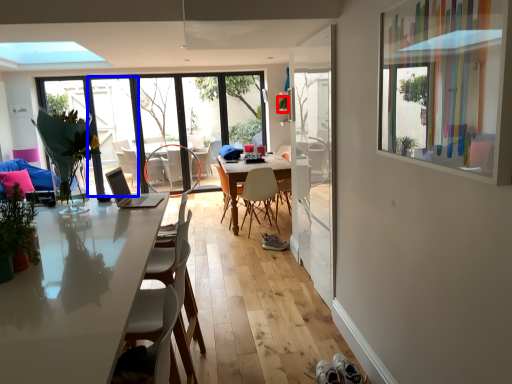
Question: Among these objects, which one is farthest to the camera, plant (highlighted by a red box) or door (highlighted by a blue box)?

Choices:
 (A) plant
 (B) door

Answer: (A)